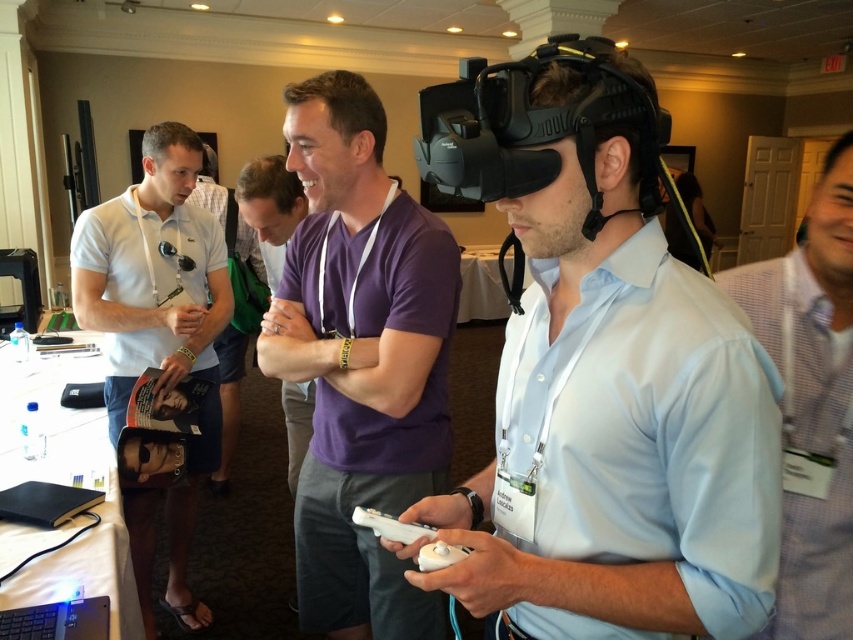
Question: Is purple matte shirt at center to the right of white checkered shirt at right from the viewer's perspective?

Choices:
 (A) yes
 (B) no

Answer: (B)

Question: Can you confirm if white checkered shirt at right is positioned below white matte game controller at center?

Choices:
 (A) no
 (B) yes

Answer: (A)

Question: Which object appears farthest from the camera in this image?

Choices:
 (A) white checkered shirt at right
 (B) white matte game controller at center
 (C) purple matte shirt at center
 (D) matte black vr headset at center

Answer: (C)

Question: Based on their relative distances, which object is farther from the purple matte shirt at center?

Choices:
 (A) white checkered shirt at right
 (B) white matte game controller at center
 (C) matte black vr headset at center
 (D) white matte polo shirt at left

Answer: (D)

Question: Can you confirm if purple matte shirt at center is thinner than white matte polo shirt at left?

Choices:
 (A) yes
 (B) no

Answer: (A)

Question: Estimate the real-world distances between objects in this image. Which object is farther from the purple matte shirt at center?

Choices:
 (A) white matte game controller at center
 (B) white matte polo shirt at left

Answer: (B)